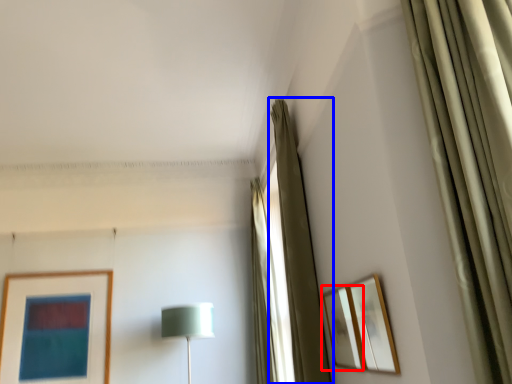
Question: Which of the following is the farthest to the observer, picture frame (highlighted by a red box) or curtain (highlighted by a blue box)?

Choices:
 (A) picture frame
 (B) curtain

Answer: (B)